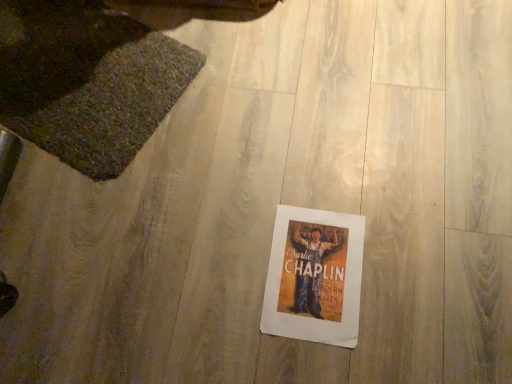
Question: Choose the correct answer: Is white paper poster at center inside textured woolen mat at upper left or outside it?

Choices:
 (A) inside
 (B) outside

Answer: (B)

Question: In terms of height, does white paper poster at center look taller or shorter compared to textured woolen mat at upper left?

Choices:
 (A) short
 (B) tall

Answer: (A)

Question: Considering the relative positions of white paper poster at center and textured woolen mat at upper left in the image provided, is white paper poster at center to the left or to the right of textured woolen mat at upper left?

Choices:
 (A) left
 (B) right

Answer: (B)

Question: Is textured woolen mat at upper left taller or shorter than white paper poster at center?

Choices:
 (A) tall
 (B) short

Answer: (A)

Question: Looking at the image, does textured woolen mat at upper left seem bigger or smaller compared to white paper poster at center?

Choices:
 (A) small
 (B) big

Answer: (B)

Question: Relative to white paper poster at center, is textured woolen mat at upper left in front or behind?

Choices:
 (A) behind
 (B) front

Answer: (A)

Question: From a real-world perspective, is textured woolen mat at upper left positioned above or below white paper poster at center?

Choices:
 (A) above
 (B) below

Answer: (A)